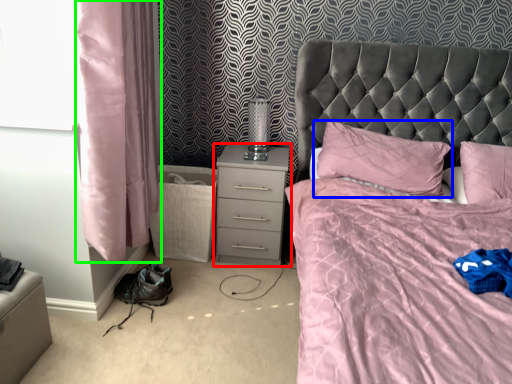
Question: Which object is the farthest from nightstand (highlighted by a red box)? Choose among these: pillow (highlighted by a blue box) or curtain (highlighted by a green box).

Choices:
 (A) pillow
 (B) curtain

Answer: (B)